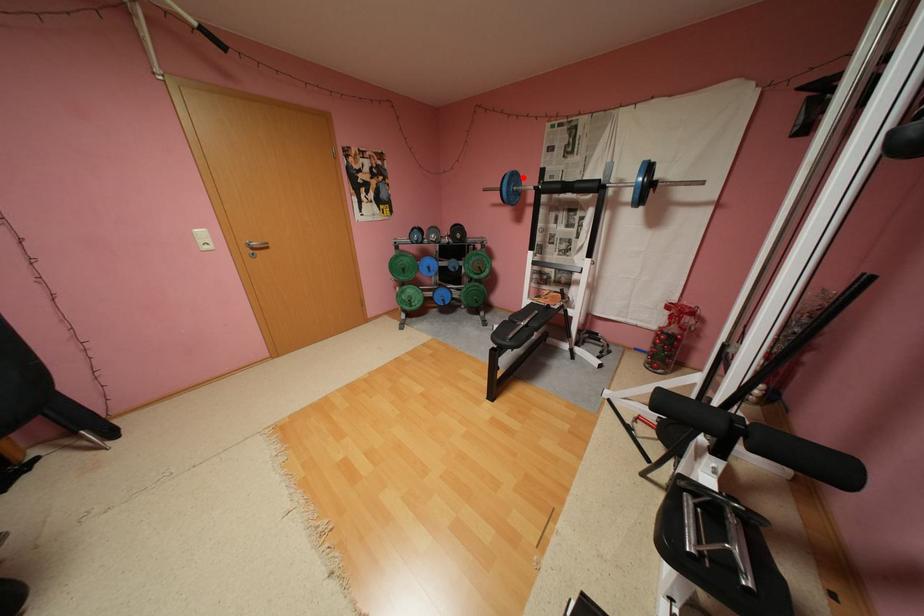
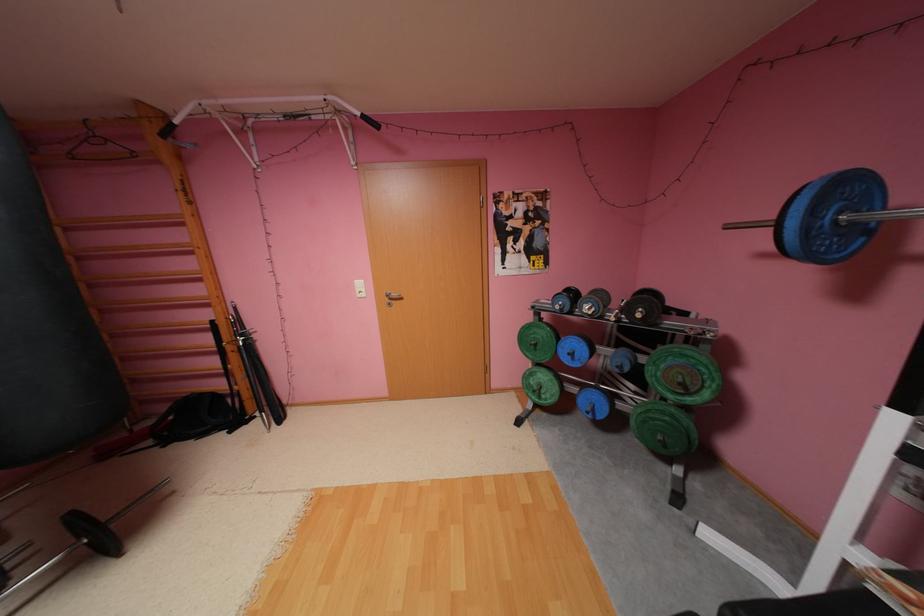
Question: I am providing you with two images of the same scene from different viewpoints. A red point is marked on the first image. Can you still see the location of the red point in image 2?

Choices:
 (A) Yes
 (B) No

Answer: (A)